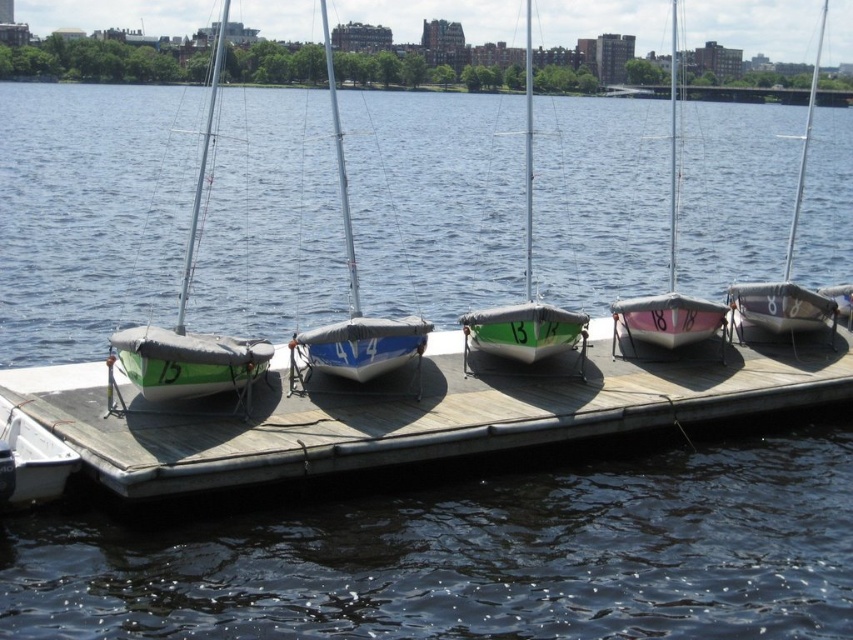
Question: Does white matte sailboat at center have a larger size compared to pink matte sailboat at right?

Choices:
 (A) yes
 (B) no

Answer: (B)

Question: Can you confirm if green matte sailboat at left is thinner than pink matte sailboat at right?

Choices:
 (A) no
 (B) yes

Answer: (B)

Question: Is green matte sailboat at left closer to camera compared to white plastic boat at lower left?

Choices:
 (A) yes
 (B) no

Answer: (B)

Question: Estimate the real-world distances between objects in this image. Which object is closer to the white matte sailboat at center?

Choices:
 (A) white plastic boat at lower left
 (B) metallic gray sailboat at right

Answer: (A)

Question: Among these points, which one is nearest to the camera?

Choices:
 (A) (256, 368)
 (B) (86, 369)

Answer: (A)

Question: Among these points, which one is nearest to the camera?

Choices:
 (A) (525, 152)
 (B) (311, 332)

Answer: (B)